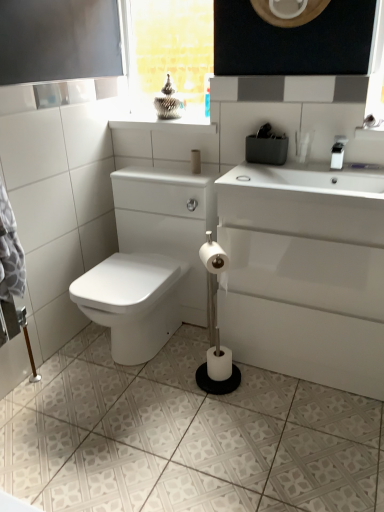
Question: Does white glossy porcelain at lower right have a lesser height compared to matte beige toilet paper at center, arranged as the third toilet paper when ordered from the bottom?

Choices:
 (A) no
 (B) yes

Answer: (A)

Question: From the image's perspective, is white glossy porcelain at lower right on matte beige toilet paper at center, acting as the 3th toilet paper starting from the front?

Choices:
 (A) yes
 (B) no

Answer: (B)

Question: From the image's perspective, is white glossy porcelain at lower right located beneath matte beige toilet paper at center, acting as the 1th toilet paper starting from the top?

Choices:
 (A) no
 (B) yes

Answer: (B)

Question: Could you tell me if white glossy porcelain at lower right is turned towards matte beige toilet paper at center, marked as the 1th toilet paper in a back-to-front arrangement?

Choices:
 (A) yes
 (B) no

Answer: (B)

Question: Does white glossy porcelain at lower right appear on the left side of matte beige toilet paper at center, arranged as the third toilet paper when ordered from the bottom?

Choices:
 (A) yes
 (B) no

Answer: (B)

Question: Is white glossy porcelain at lower right positioned behind matte beige toilet paper at center, marked as the 1th toilet paper in a back-to-front arrangement?

Choices:
 (A) yes
 (B) no

Answer: (B)

Question: Can you confirm if white glossy porcelain at lower right is positioned to the right of white plastic faucet at upper right?

Choices:
 (A) no
 (B) yes

Answer: (A)

Question: From a real-world perspective, is white glossy porcelain at lower right beneath white plastic faucet at upper right?

Choices:
 (A) yes
 (B) no

Answer: (A)

Question: Is white glossy porcelain at lower right taller than white plastic faucet at upper right?

Choices:
 (A) no
 (B) yes

Answer: (B)

Question: Considering the relative sizes of white glossy porcelain at lower right and white plastic faucet at upper right in the image provided, is white glossy porcelain at lower right smaller than white plastic faucet at upper right?

Choices:
 (A) yes
 (B) no

Answer: (B)

Question: Is white glossy porcelain at lower right positioned before white plastic faucet at upper right?

Choices:
 (A) no
 (B) yes

Answer: (B)

Question: Is white plastic faucet at upper right at the back of white glossy porcelain at lower right?

Choices:
 (A) yes
 (B) no

Answer: (B)

Question: Considering the relative sizes of clear glass window at upper center and matte beige toilet paper at center, marked as the 1th toilet paper in a back-to-front arrangement, in the image provided, is clear glass window at upper center taller than matte beige toilet paper at center, marked as the 1th toilet paper in a back-to-front arrangement,?

Choices:
 (A) yes
 (B) no

Answer: (A)